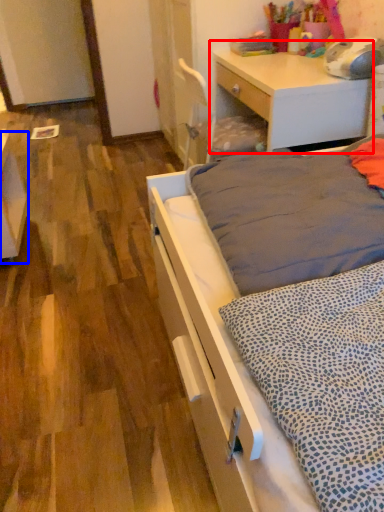
Question: Which object appears closest to the camera in this image, desk (highlighted by a red box) or vanity (highlighted by a blue box)?

Choices:
 (A) desk
 (B) vanity

Answer: (A)